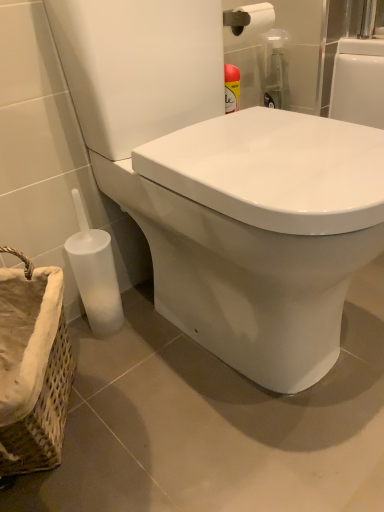
Image resolution: width=384 pixels, height=512 pixels. Identify the location of white matte toilet brush at lower left. (95, 274).

The width and height of the screenshot is (384, 512). What do you see at coordinates (223, 186) in the screenshot?
I see `white glossy toilet at lower left` at bounding box center [223, 186].

Where is `woven fabric basket at lower left`? woven fabric basket at lower left is located at coordinates (33, 368).

In terms of width, does white matte toilet brush at lower left look wider or thinner when compared to woven fabric basket at lower left?

Considering their sizes, white matte toilet brush at lower left looks slimmer than woven fabric basket at lower left.

Is white matte toilet brush at lower left behind woven fabric basket at lower left?

Yes, white matte toilet brush at lower left is further from the viewer.

Could you tell me if white matte toilet brush at lower left is facing woven fabric basket at lower left?

No, white matte toilet brush at lower left is not facing towards woven fabric basket at lower left.

Would you consider white matte toilet brush at lower left to be distant from woven fabric basket at lower left?

They are positioned close to each other.

From the image's perspective, who appears lower, white glossy toilet at lower left or white matte toilet brush at lower left?

white matte toilet brush at lower left.

From a real-world perspective, is white glossy toilet at lower left above or below white matte toilet brush at lower left?

From a real-world perspective, white glossy toilet at lower left is physically above white matte toilet brush at lower left.

Which is farther from the camera, (146, 174) or (102, 318)?

The point (102, 318) is behind.

In the scene shown: Considering the positions of objects white glossy toilet at lower left and white matte toilet brush at lower left in the image provided, who is more to the left, white glossy toilet at lower left or white matte toilet brush at lower left?

white matte toilet brush at lower left is more to the left.

Between white matte toilet brush at lower left and white glossy toilet at lower left, which one appears on the right side from the viewer's perspective?

Positioned to the right is white glossy toilet at lower left.

Between white matte toilet brush at lower left and white glossy toilet at lower left, which one has smaller width?

→ With smaller width is white matte toilet brush at lower left.

At what (x,y) coordinates should I click in order to perform the action: click on toilet above the white matte toilet brush at lower left (from the image's perspective). Please return your answer as a coordinate pair (x, y). Looking at the image, I should click on (223, 186).

Choose the correct answer: Is white matte toilet brush at lower left inside white glossy toilet at lower left or outside it?

white matte toilet brush at lower left is not enclosed by white glossy toilet at lower left.

How different are the orientations of white glossy toilet at lower left and woven fabric basket at lower left in degrees?

The facing directions of white glossy toilet at lower left and woven fabric basket at lower left are 53.6 degrees apart.

From a real-world perspective, who is located higher, white glossy toilet at lower left or woven fabric basket at lower left?

white glossy toilet at lower left, from a real-world perspective.

Choose the correct answer: Is white glossy toilet at lower left inside woven fabric basket at lower left or outside it?

white glossy toilet at lower left is not enclosed by woven fabric basket at lower left.

Can you confirm if white glossy toilet at lower left is smaller than woven fabric basket at lower left?

No, white glossy toilet at lower left is not smaller than woven fabric basket at lower left.

Looking at this image, in the image, is woven fabric basket at lower left positioned in front of or behind white glossy toilet at lower left?

In the image, woven fabric basket at lower left appears behind white glossy toilet at lower left.

Where is `basket container to the left of white glossy toilet at lower left`? basket container to the left of white glossy toilet at lower left is located at coordinates (33, 368).

Would you consider woven fabric basket at lower left to be distant from white glossy toilet at lower left?

No, woven fabric basket at lower left is not far from white glossy toilet at lower left.

Does woven fabric basket at lower left turn towards white glossy toilet at lower left?

Yes, woven fabric basket at lower left is aimed at white glossy toilet at lower left.

Visually, is woven fabric basket at lower left positioned to the left or to the right of white matte toilet brush at lower left?

Clearly, woven fabric basket at lower left is on the left of white matte toilet brush at lower left in the image.

Is woven fabric basket at lower left looking in the opposite direction of white matte toilet brush at lower left?

woven fabric basket at lower left does not have its back to white matte toilet brush at lower left.

From a real-world perspective, which is physically below, woven fabric basket at lower left or white matte toilet brush at lower left?

woven fabric basket at lower left is physically lower.

Is point (45, 414) farther from camera compared to point (89, 254)?

No, it is in front of (89, 254).

The image size is (384, 512). What are the coordinates of `bottle above the woven fabric basket at lower left (from the image's perspective)` in the screenshot? It's located at (95, 274).

Where is `toilet positioned vertically above the white matte toilet brush at lower left (from a real-world perspective)`? This screenshot has width=384, height=512. toilet positioned vertically above the white matte toilet brush at lower left (from a real-world perspective) is located at coordinates (223, 186).

Based on their spatial positions, is white matte toilet brush at lower left or white glossy toilet at lower left further from woven fabric basket at lower left?

white glossy toilet at lower left is positioned further to the anchor woven fabric basket at lower left.

From the image, which object appears to be nearer to white glossy toilet at lower left, woven fabric basket at lower left or white matte toilet brush at lower left?

white matte toilet brush at lower left is closer to white glossy toilet at lower left.

Looking at the image, which one is located further to woven fabric basket at lower left, white glossy toilet at lower left or white matte toilet brush at lower left?

white glossy toilet at lower left lies further to woven fabric basket at lower left than the other object.

Looking at the image, which one is located closer to white matte toilet brush at lower left, white glossy toilet at lower left or woven fabric basket at lower left?

Among the two, woven fabric basket at lower left is located nearer to white matte toilet brush at lower left.

When comparing their distances from white matte toilet brush at lower left, does woven fabric basket at lower left or white glossy toilet at lower left seem further?

Among the two, white glossy toilet at lower left is located further to white matte toilet brush at lower left.

Based on their spatial positions, is white matte toilet brush at lower left or woven fabric basket at lower left closer to white glossy toilet at lower left?

Among the two, white matte toilet brush at lower left is located nearer to white glossy toilet at lower left.

Where is `basket container between white glossy toilet at lower left and white matte toilet brush at lower left from front to back`? The height and width of the screenshot is (512, 384). basket container between white glossy toilet at lower left and white matte toilet brush at lower left from front to back is located at coordinates (33, 368).